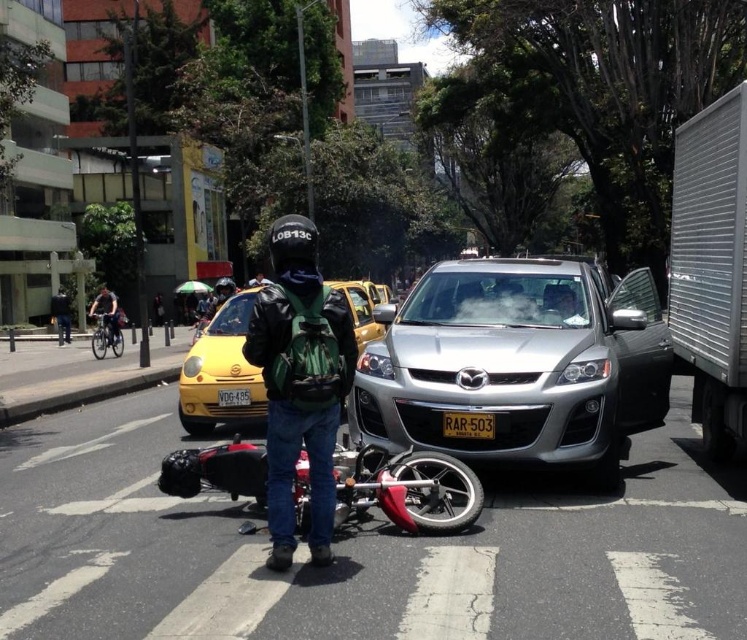
Question: Observing the image, what is the correct spatial positioning of shiny black motorcycle at center in reference to yellow matte license plate at center?

Choices:
 (A) above
 (B) below

Answer: (A)

Question: Does silver metallic suv at center have a greater width compared to shiny red motorcycle at center?

Choices:
 (A) yes
 (B) no

Answer: (A)

Question: In this image, where is yellow plastic license plate at center located relative to shiny black motorcycle at center?

Choices:
 (A) right
 (B) left

Answer: (A)

Question: Which object appears closest to the camera in this image?

Choices:
 (A) shiny red motorcycle at center
 (B) silver metallic suv at center

Answer: (A)

Question: Which of these objects is positioned closest to the shiny black motorcycle at center?

Choices:
 (A) yellow matte license plate at center
 (B) matte black helmet at center
 (C) shiny red motorcycle at center
 (D) yellow matte taxi at center

Answer: (D)

Question: Based on their relative distances, which object is farther from the yellow matte taxi at center?

Choices:
 (A) green fabric helmet at upper center
 (B) shiny black motorcycle at center

Answer: (A)